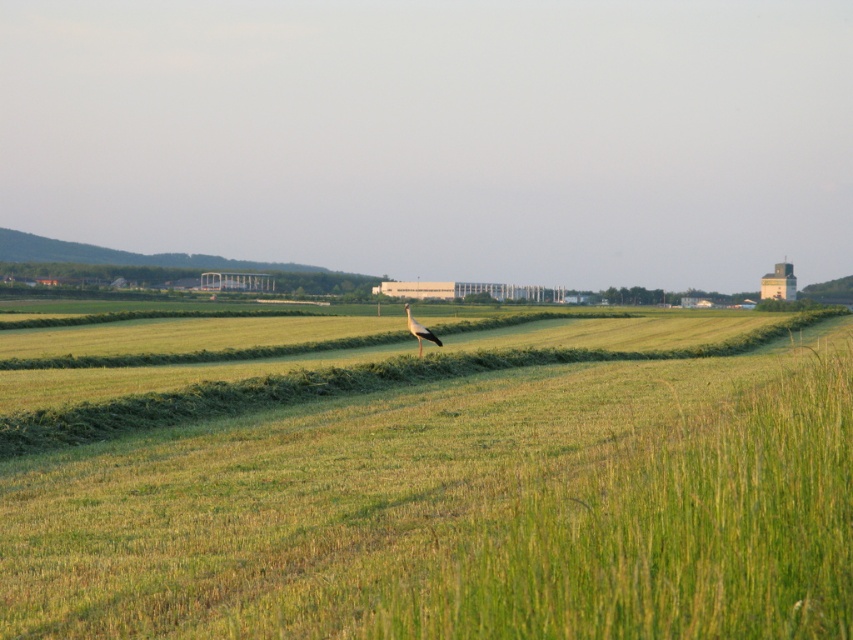
Is green grassy field at center closer to the viewer compared to white feathered bird at center?

Yes, it is.

Is point (683, 483) positioned behind point (416, 326)?

No, it is in front of (416, 326).

Which is behind, point (445, 456) or point (421, 332)?

The point (421, 332) is more distant.

Where is `green grassy field at center`? The image size is (853, 640). green grassy field at center is located at coordinates (459, 512).